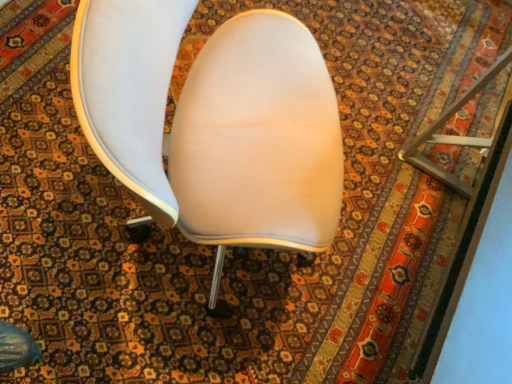
You are a GUI agent. You are given a task and a screenshot of the screen. Output one action in this format:
    pyautogui.click(x=<x>, y=<y>)
    Task: Click on the satin white chair at center
    
    Given the screenshot: What is the action you would take?
    pyautogui.click(x=215, y=124)

The image size is (512, 384). What do you see at coordinates (215, 124) in the screenshot? I see `satin white chair at center` at bounding box center [215, 124].

Where is `satin white chair at center`? satin white chair at center is located at coordinates (215, 124).